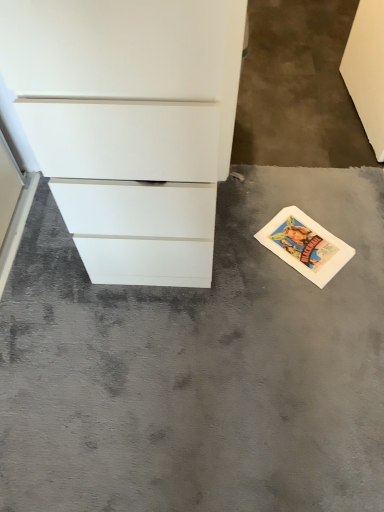
At what (x,y) coordinates should I click in order to perform the action: click on free space to the right of white matte chest of drawers at left. Please return your answer as a coordinate pair (x, y). Looking at the image, I should click on (275, 244).